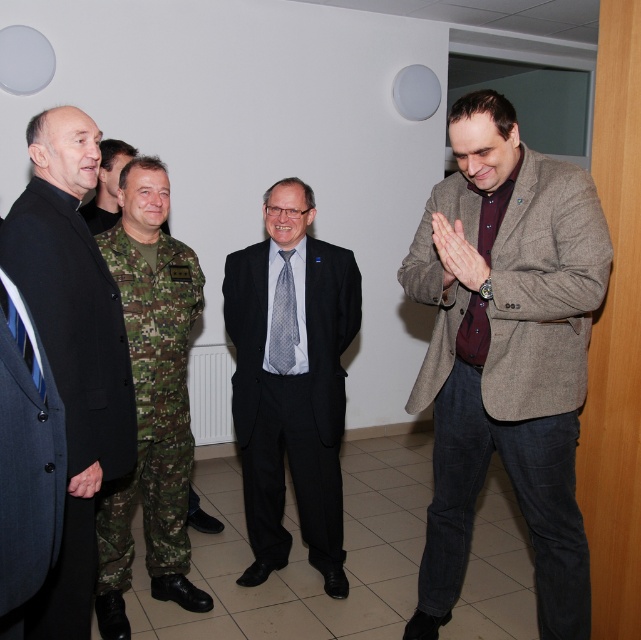
Question: Does dark gray suit at center have a larger size compared to camouflage uniform at center?

Choices:
 (A) yes
 (B) no

Answer: (A)

Question: Among these points, which one is farthest from the camera?

Choices:
 (A) (117, 358)
 (B) (287, 308)

Answer: (B)

Question: Which is nearer to the dark gray suit at center?

Choices:
 (A) dark blue suit at left
 (B) matte gray blazer at right
 (C) camouflage uniform at center

Answer: (B)

Question: In this image, where is matte gray blazer at right located relative to gray dotted tie at center?

Choices:
 (A) above
 (B) below

Answer: (B)

Question: Which is nearer to the camouflage uniform at center?

Choices:
 (A) dark gray suit at center
 (B) dark blue suit at left

Answer: (A)

Question: Is matte gray blazer at right smaller than dark gray suit at center?

Choices:
 (A) no
 (B) yes

Answer: (A)